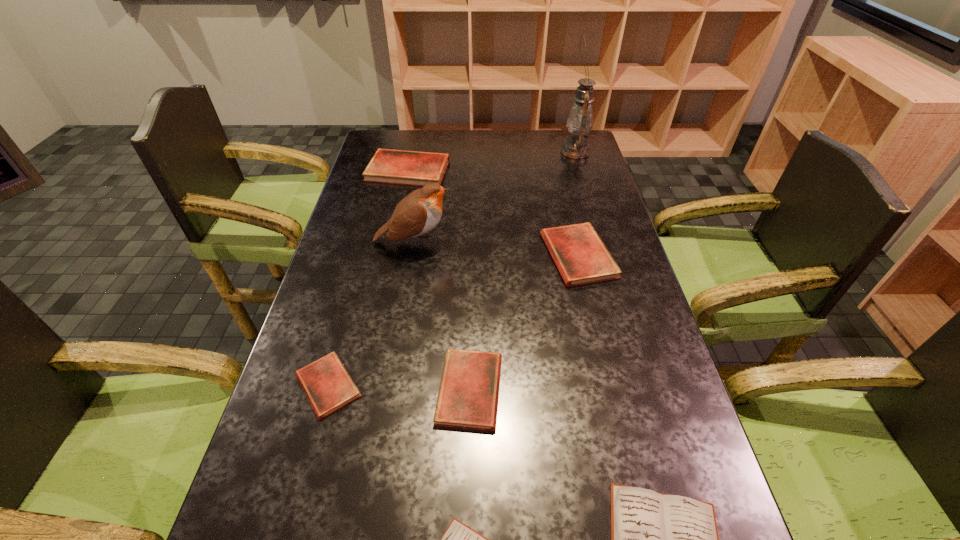
Find the location of `vacant region located at the face of the seventh shortest object`. vacant region located at the face of the seventh shortest object is located at coordinates (520, 242).

This screenshot has height=540, width=960. What are the coordinates of `vacant space situated on the right of the farthest red diary` in the screenshot? It's located at (524, 170).

Identify the location of free space located on the front of the fifth shortest diary. The height and width of the screenshot is (540, 960). coord(612,403).

The width and height of the screenshot is (960, 540). Find the location of `vacant area situated 0.380m on the right of the third red diary from left to right`. vacant area situated 0.380m on the right of the third red diary from left to right is located at coordinates (678, 389).

You are a GUI agent. You are given a task and a screenshot of the screen. Output one action in this format:
    pyautogui.click(x=<x>, y=<y>)
    Task: Click on the blank space located on the front of the smallest red diary
    The width and height of the screenshot is (960, 540).
    Given the screenshot: What is the action you would take?
    pyautogui.click(x=299, y=492)

Where is `oil lamp positioned at the far edge`? Image resolution: width=960 pixels, height=540 pixels. oil lamp positioned at the far edge is located at coordinates (580, 120).

This screenshot has width=960, height=540. Find the location of `diary positioned at the far edge`. diary positioned at the far edge is located at coordinates (415, 168).

The image size is (960, 540). What are the coordinates of `bird that is positioned at the left edge` in the screenshot? It's located at (418, 213).

The height and width of the screenshot is (540, 960). I want to click on oil lamp that is at the right edge, so tap(580, 120).

Find the location of a particular element. Image resolution: width=960 pixels, height=540 pixels. diary positioned at the right edge is located at coordinates (581, 257).